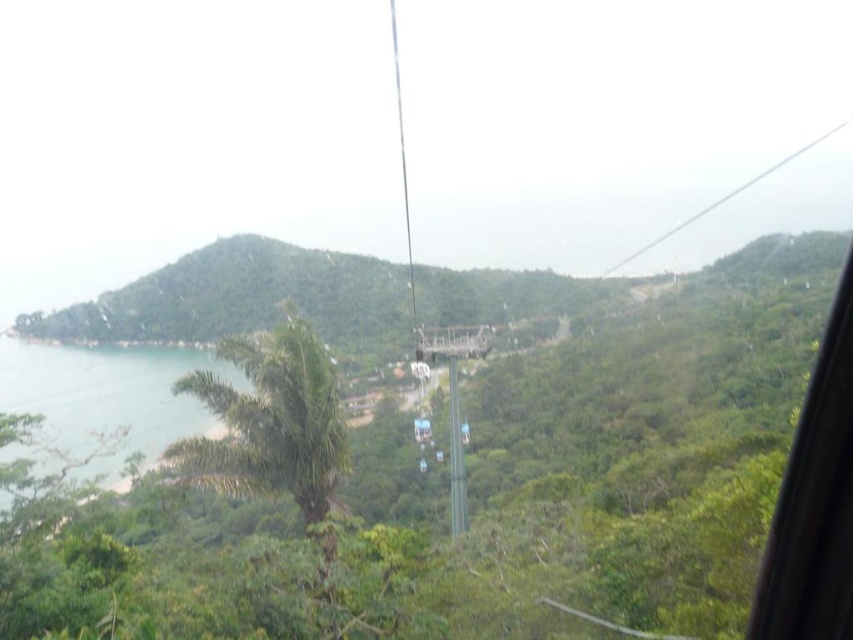
You are a tourist in a cable car and want to take a photo of both the green leafy mountain at center and the clear blue water at lower left. Based on their sizes in the scene, which one would appear wider in your photo?

The green leafy mountain at center would appear wider in your photo because its width is larger than that of the clear blue water at lower left.

You are a passenger in a cable car and want to take a photo of the point at coordinates [300,372]. The camera you have can focus on objects up to 30 meters away. Will the point be in focus?

The point at coordinates [300,372] is 25.90 meters from the camera, which is within the camera focus range of up to 30 meters. Yes, the point will be in focus.

You are standing at the point with coordinates point (323, 310) and want to take a photo of the cable car system from your current position. The camera you are using has a maximum range of 120 meters. Will you be able to capture the cable car system in your photo?

The point (323, 310) and camera are 128.91 meters apart from each other. Since the camera has a maximum range of 120 meters, you will not be able to capture the cable car system in your photo because the distance exceeds the camera range.